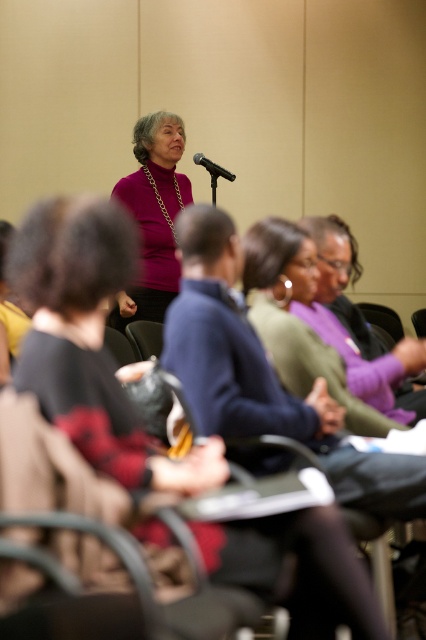
Question: Considering the real-world distances, which object is farthest from the black matte microphone at center?

Choices:
 (A) purple matte turtleneck sweater at center
 (B) matte purple sweater at upper center
 (C) matte purple sweater at center

Answer: (B)

Question: Which is nearer to the matte purple sweater at upper center?

Choices:
 (A) purple matte turtleneck sweater at center
 (B) matte purple sweater at center

Answer: (B)

Question: Which object appears closest to the camera in this image?

Choices:
 (A) purple matte turtleneck sweater at center
 (B) matte purple sweater at upper center

Answer: (B)

Question: Does matte purple sweater at upper center lie behind purple matte turtleneck sweater at center?

Choices:
 (A) no
 (B) yes

Answer: (A)

Question: Observing the image, what is the correct spatial positioning of matte purple sweater at upper center in reference to purple matte turtleneck sweater at center?

Choices:
 (A) below
 (B) above

Answer: (A)

Question: Is matte purple sweater at center to the right of black matte microphone at center from the viewer's perspective?

Choices:
 (A) no
 (B) yes

Answer: (B)